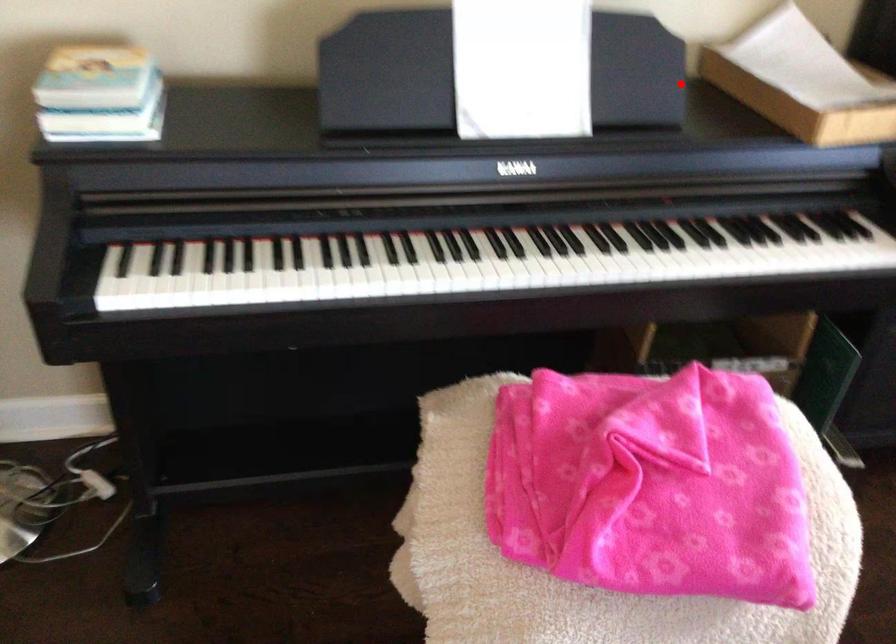
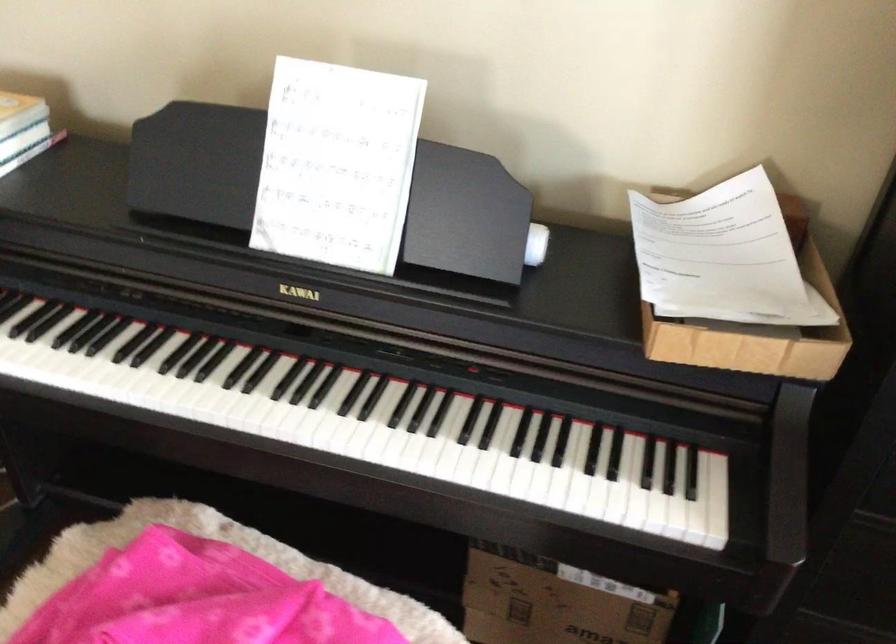
Find the pixel in the second image that matches the highlighted location in the first image.

(536, 243)